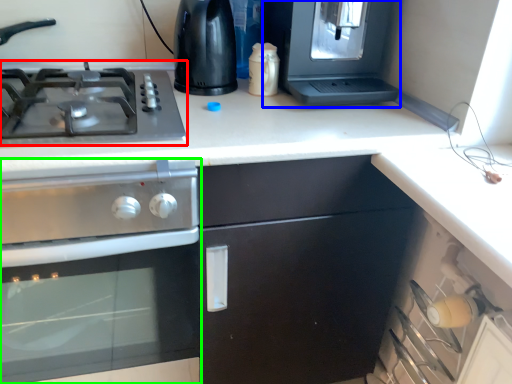
Question: Considering the real-world distances, which object is closest to gas stove (highlighted by a red box)? appliance (highlighted by a blue box) or kitchen appliance (highlighted by a green box).

Choices:
 (A) appliance
 (B) kitchen appliance

Answer: (B)